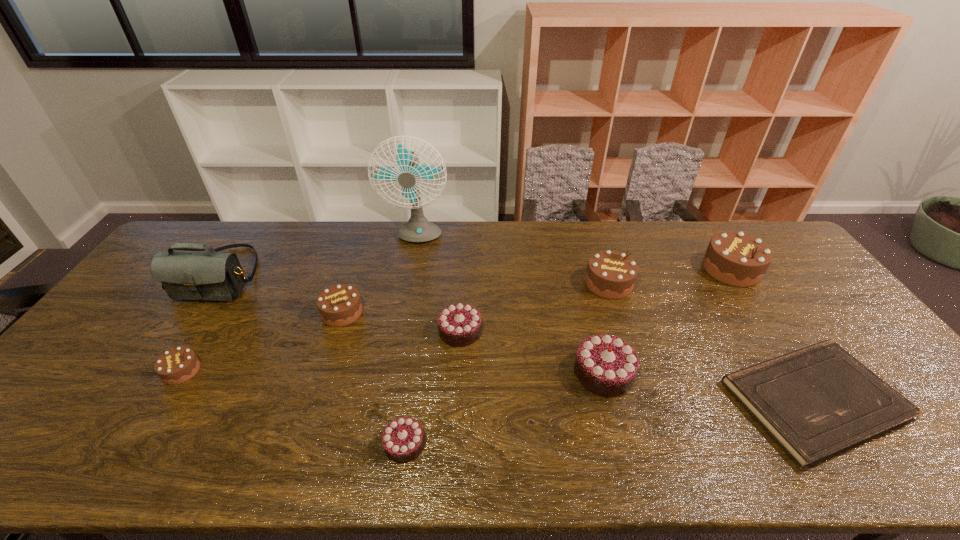
In order to click on chocolate cake that is at the far edge in this screenshot , I will do `click(734, 258)`.

Image resolution: width=960 pixels, height=540 pixels. I want to click on chocolate cake that is at the near edge, so click(403, 440).

Locate an element on the screen. This screenshot has width=960, height=540. paperback book that is at the near edge is located at coordinates [817, 402].

What are the coordinates of `object located at the left edge` in the screenshot? It's located at (218, 276).

Image resolution: width=960 pixels, height=540 pixels. I want to click on chocolate cake that is at the right edge, so click(x=734, y=258).

At what (x,y) coordinates should I click in order to perform the action: click on paperback book positioned at the right edge. Please return your answer as a coordinate pair (x, y). This screenshot has height=540, width=960. Looking at the image, I should click on coord(817,402).

This screenshot has height=540, width=960. Identify the location of object at the far left corner. (218, 276).

Locate an element on the screen. This screenshot has width=960, height=540. object located at the far right corner is located at coordinates (734, 258).

Locate an element on the screen. Image resolution: width=960 pixels, height=540 pixels. object that is at the near right corner is located at coordinates (817, 402).

This screenshot has height=540, width=960. Find the location of `vacant area at the far edge`. vacant area at the far edge is located at coordinates (588, 255).